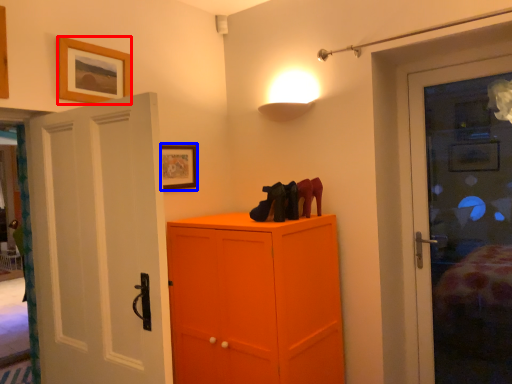
Question: Which object appears farthest to the camera in this image, picture frame (highlighted by a red box) or picture frame (highlighted by a blue box)?

Choices:
 (A) picture frame
 (B) picture frame

Answer: (B)